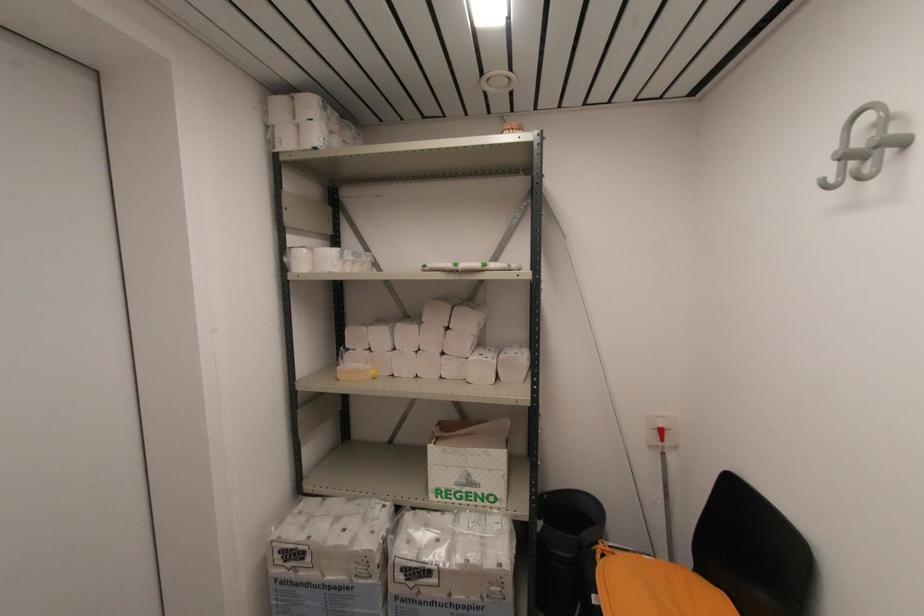
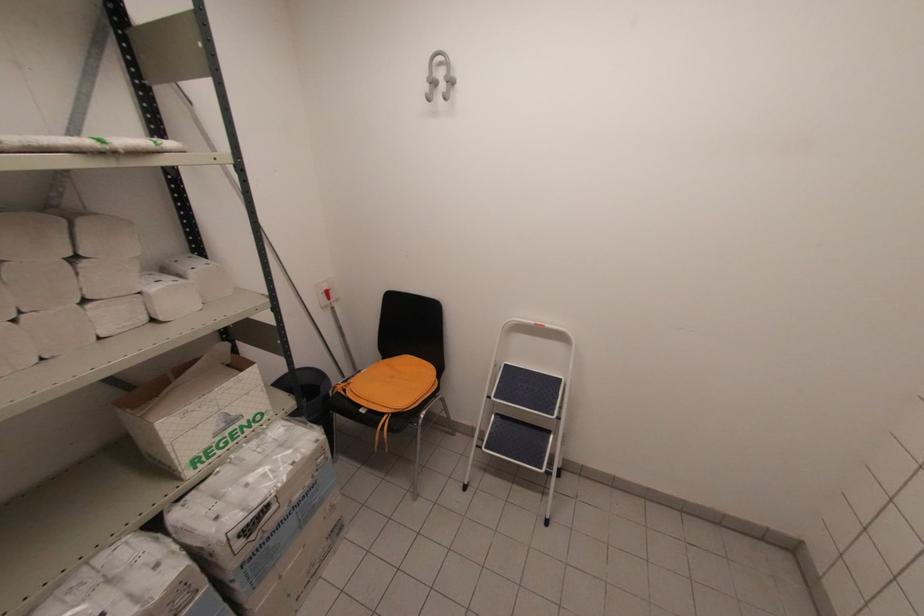
Where in the second image is the point corresponding to point (646, 556) from the first image?

(362, 371)